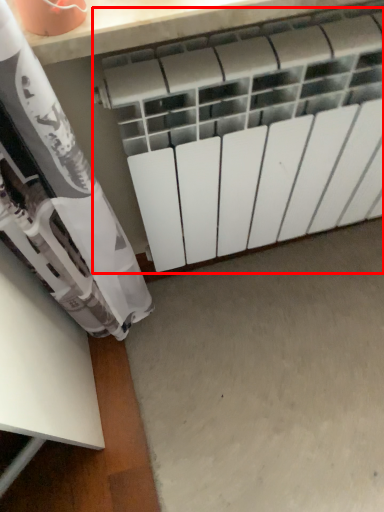
Question: Considering the relative positions of radiator (annotated by the red box) and concrete in the image provided, where is radiator (annotated by the red box) located with respect to the staircase?

Choices:
 (A) left
 (B) right

Answer: (A)